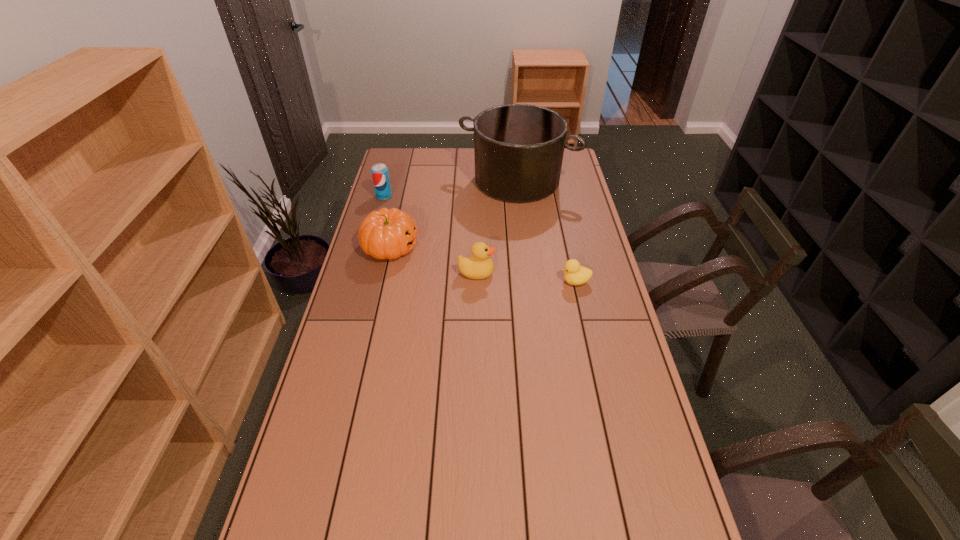
In the image, there is a desktop. Identify the location of vacant space at the right edge. The width and height of the screenshot is (960, 540). (586, 296).

This screenshot has height=540, width=960. I want to click on blank space at the far left corner of the desktop, so click(395, 151).

Where is `vacant space that is in between the taller duck and the shortest object`? This screenshot has height=540, width=960. vacant space that is in between the taller duck and the shortest object is located at coordinates (526, 277).

Where is `empty location between the soda can and the taller duck`? Image resolution: width=960 pixels, height=540 pixels. empty location between the soda can and the taller duck is located at coordinates (430, 234).

Identify the location of free spot between the pan and the shorter duck. (546, 231).

Identify which object is the third closest to the taller duck. Please provide its 2D coordinates. Your answer should be formatted as a tuple, i.e. [(x, y)], where the tuple contains the x and y coordinates of a point satisfying the conditions above.

[(518, 148)]

Identify which object is the nearest to the pumpkin. Please provide its 2D coordinates. Your answer should be formatted as a tuple, i.e. [(x, y)], where the tuple contains the x and y coordinates of a point satisfying the conditions above.

[(480, 266)]

You are a GUI agent. You are given a task and a screenshot of the screen. Output one action in this format:
    pyautogui.click(x=<x>, y=<y>)
    Task: Click on the vacant space that satisfies the following two spatial constraints: 1. on the front side of the pan; 2. at the beak of the taller duck
    The height and width of the screenshot is (540, 960).
    Given the screenshot: What is the action you would take?
    pyautogui.click(x=527, y=273)